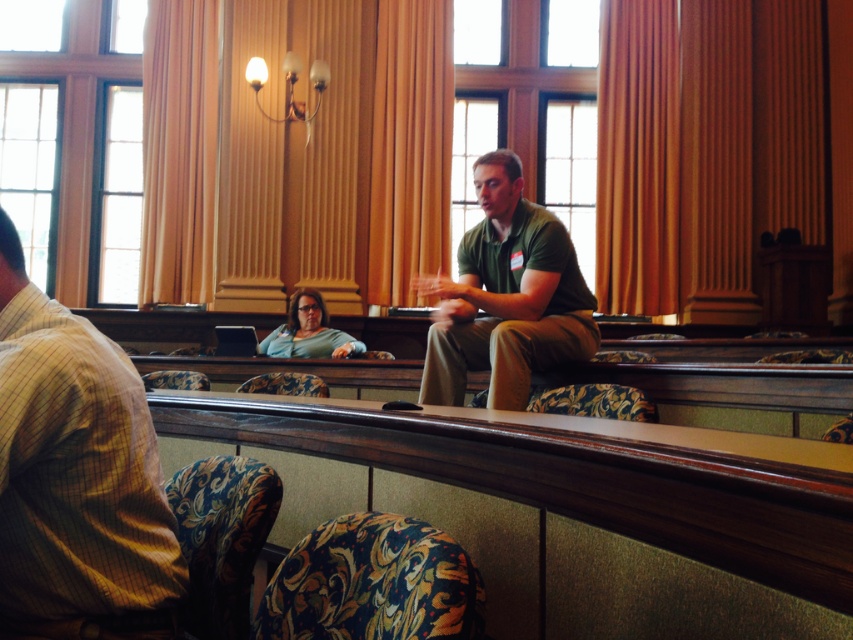
Is wooden table at center thinner than yellow striped shirt at left?

In fact, wooden table at center might be wider than yellow striped shirt at left.

Between point (824, 465) and point (13, 461), which one is positioned behind?

The point (13, 461) is behind.

Is point (223, 416) closer to camera compared to point (125, 460)?

No.

The width and height of the screenshot is (853, 640). Find the location of `wooden table at center`. wooden table at center is located at coordinates (575, 508).

How far apart are yellow striped shirt at left and green matte shirt at center?

yellow striped shirt at left is 1.89 meters from green matte shirt at center.

Does yellow striped shirt at left have a greater height compared to green matte shirt at center?

In fact, yellow striped shirt at left may be shorter than green matte shirt at center.

Which is in front, point (25, 422) or point (492, 237)?

Point (25, 422)

You are a GUI agent. You are given a task and a screenshot of the screen. Output one action in this format:
    pyautogui.click(x=<x>, y=<y>)
    Task: Click on the yellow striped shirt at left
    The image size is (853, 640).
    Given the screenshot: What is the action you would take?
    pyautogui.click(x=76, y=477)

Does yellow striped shirt at left have a greater width compared to matte green shirt at center?

No, yellow striped shirt at left is not wider than matte green shirt at center.

Is yellow striped shirt at left positioned at the back of matte green shirt at center?

That is False.

The width and height of the screenshot is (853, 640). I want to click on yellow striped shirt at left, so click(76, 477).